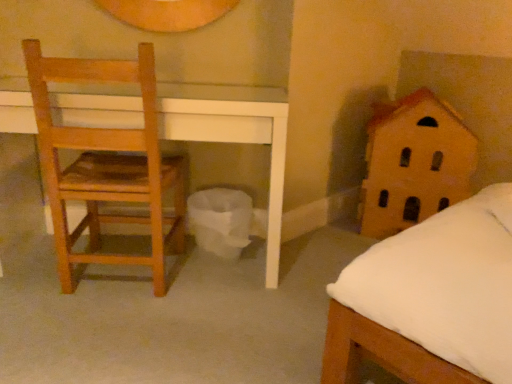
You are a GUI agent. You are given a task and a screenshot of the screen. Output one action in this format:
    pyautogui.click(x=<x>, y=<y>)
    Task: Click on the free region on the left part of wooden chair at left
    The width and height of the screenshot is (512, 384).
    Given the screenshot: What is the action you would take?
    pyautogui.click(x=34, y=280)